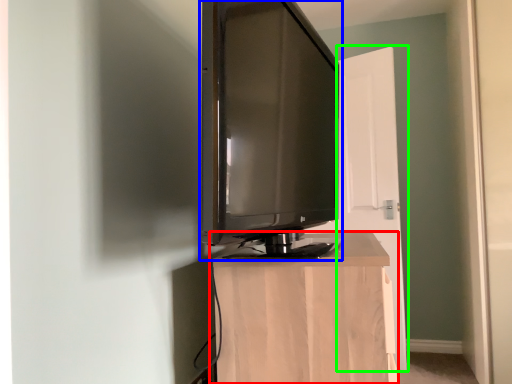
Question: Which object is positioned closest to furniture (highlighted by a red box)? Select from television (highlighted by a blue box) and door (highlighted by a green box).

Choices:
 (A) television
 (B) door

Answer: (A)